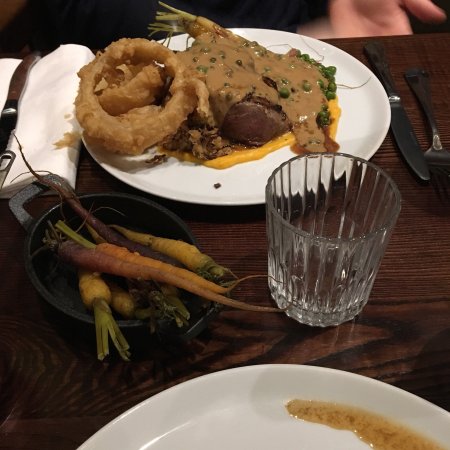
Where is `bowl`? The width and height of the screenshot is (450, 450). bowl is located at coordinates (69, 296).